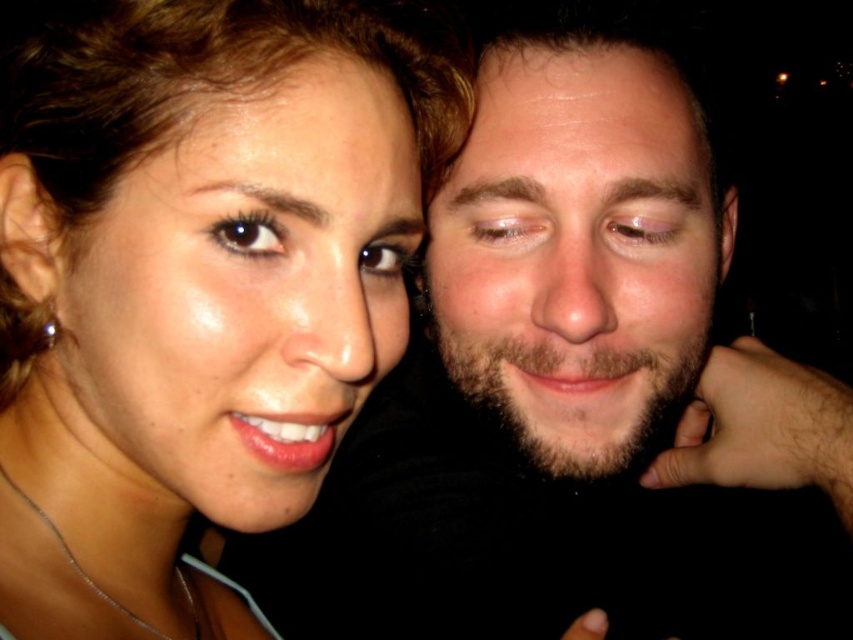
Locate an element on the screen. The width and height of the screenshot is (853, 640). pink matte eye at center is located at coordinates (641, 227).

Can you confirm if pink matte eye at center is thinner than brown glossy eye at upper left?

In fact, pink matte eye at center might be wider than brown glossy eye at upper left.

Locate an element on the screen. Image resolution: width=853 pixels, height=640 pixels. pink matte eye at center is located at coordinates (641, 227).

Where is `pink matte eye at center`? This screenshot has height=640, width=853. pink matte eye at center is located at coordinates (641, 227).

Is matte skin face at left below dry skin forehead at upper center?

Yes, matte skin face at left is below dry skin forehead at upper center.

In the scene shown: Who is more distant from viewer, (271, 157) or (624, 97)?

The point (624, 97) is behind.

Who is more distant from viewer, (x=404, y=285) or (x=637, y=180)?

Point (x=404, y=285)

I want to click on matte skin face at left, so click(231, 308).

Can you confirm if brown glossy eye at upper left is positioned to the right of brown glossy eye at center?

No, brown glossy eye at upper left is not to the right of brown glossy eye at center.

Does brown glossy eye at upper left have a larger size compared to brown glossy eye at center?

No, brown glossy eye at upper left is not bigger than brown glossy eye at center.

Does point (219, 232) lie behind point (375, 257)?

No, (219, 232) is in front of (375, 257).

Identify the location of brown glossy eye at upper left. This screenshot has width=853, height=640. (248, 234).